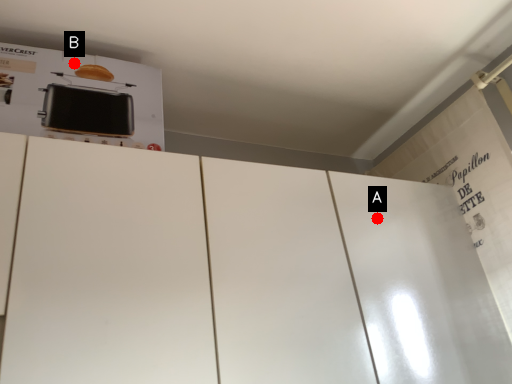
Question: Two points are circled on the image, labeled by A and B beside each circle. Which point is further to the camera?

Choices:
 (A) A is further
 (B) B is further

Answer: (A)